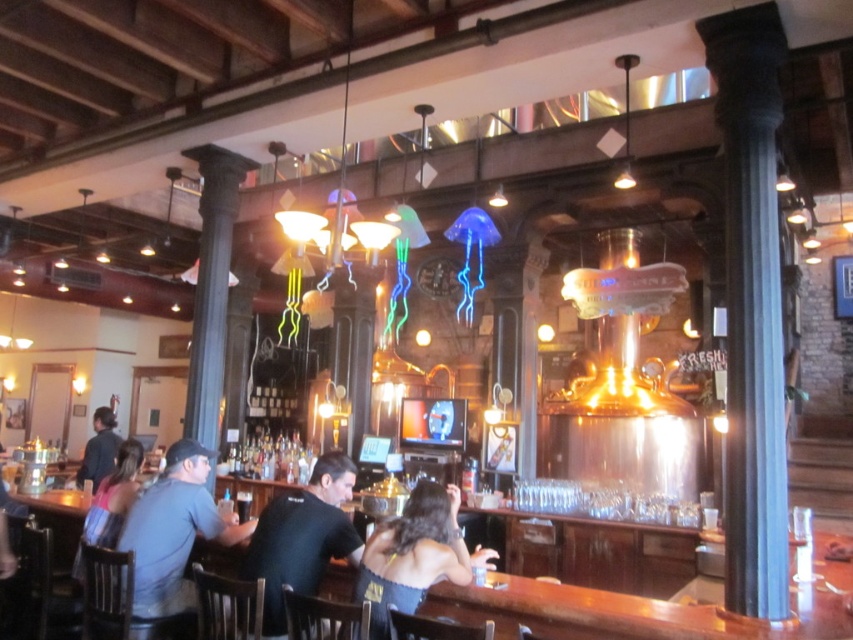
Question: Does dark blue shirt at lower left appear over black satin dress at center?

Choices:
 (A) yes
 (B) no

Answer: (B)

Question: Among these objects, which one is nearest to the camera?

Choices:
 (A) black t-shirt at center
 (B) dark blue shirt at lower left
 (C) dark blue shirt at left
 (D) black satin dress at center

Answer: (D)

Question: Among these points, which one is farthest from the camera?

Choices:
 (A) (335, 513)
 (B) (409, 508)

Answer: (A)

Question: Does black t-shirt at center have a lesser width compared to black satin dress at center?

Choices:
 (A) no
 (B) yes

Answer: (B)

Question: Can you confirm if black t-shirt at center is thinner than dark blue shirt at left?

Choices:
 (A) yes
 (B) no

Answer: (A)

Question: Which point is closer to the camera taking this photo?

Choices:
 (A) (100, 417)
 (B) (171, 564)

Answer: (B)